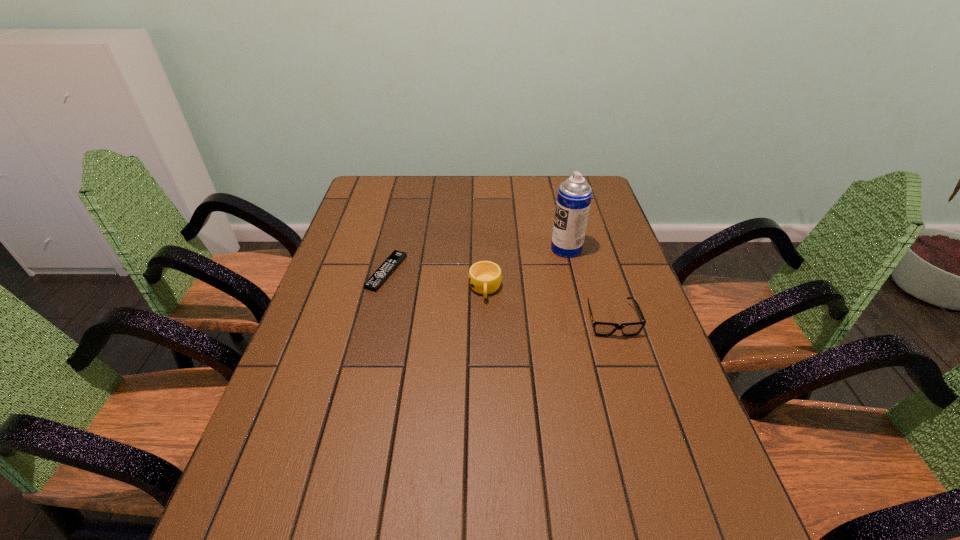
Find the location of a particular element. The height and width of the screenshot is (540, 960). object that ranks as the closest to the shortest object is located at coordinates (485, 277).

Locate an element on the screen. object that is the third closest to the second shortest object is located at coordinates (380, 276).

Locate an element on the screen. This screenshot has height=540, width=960. vacant area that satisfies the following two spatial constraints: 1. on the label side of the aerosol can; 2. on the front side of the shortest object is located at coordinates (572, 272).